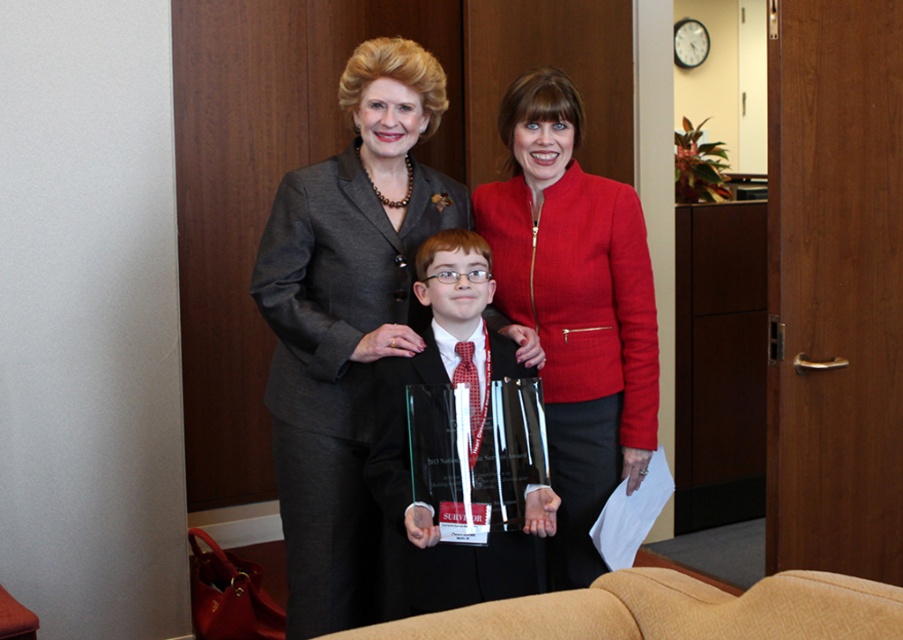
Question: Among these points, which one is nearest to the camera?

Choices:
 (A) coord(611,193)
 (B) coord(310,616)

Answer: (B)

Question: Does matte red blazer at center lie in front of clear glass award at center?

Choices:
 (A) yes
 (B) no

Answer: (B)

Question: Which object appears farthest from the camera in this image?

Choices:
 (A) matte gray business suit at center
 (B) matte red blazer at center
 (C) clear glass award at center

Answer: (A)

Question: Is matte gray business suit at center thinner than matte red blazer at center?

Choices:
 (A) yes
 (B) no

Answer: (B)

Question: Which object is positioned closest to the matte gray business suit at center?

Choices:
 (A) matte red blazer at center
 (B) clear glass award at center

Answer: (B)

Question: Is matte red blazer at center bigger than clear glass award at center?

Choices:
 (A) no
 (B) yes

Answer: (B)